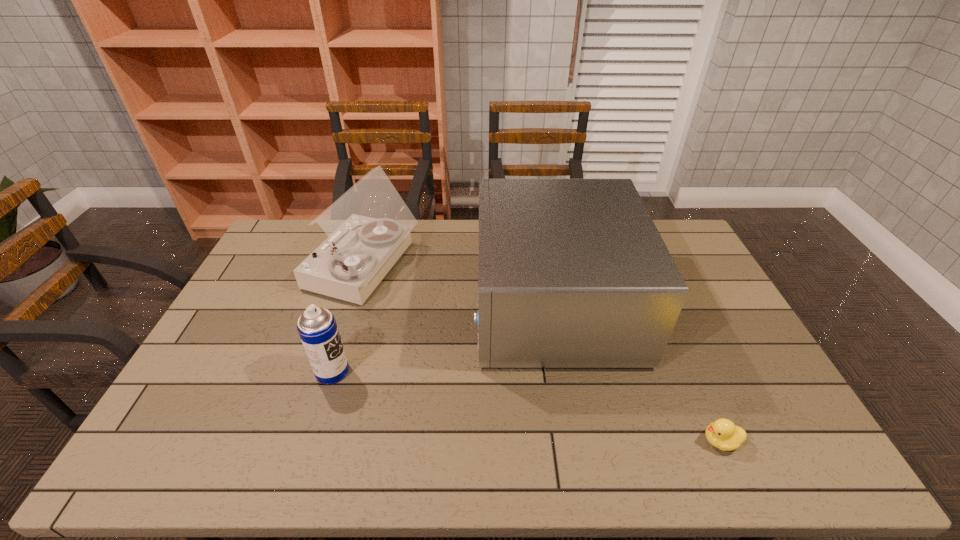
In the image, there is a desktop. At what (x,y) coordinates should I click in order to perform the action: click on free space at the left edge. Please return your answer as a coordinate pair (x, y). Image resolution: width=960 pixels, height=540 pixels. Looking at the image, I should click on (214, 380).

Locate an element on the screen. vacant space at the right edge of the desktop is located at coordinates (780, 421).

This screenshot has height=540, width=960. Identify the location of empty space that is in between the microwave oven and the aerosol can. (443, 338).

Find the location of `free space between the record player and the aerosol can`. free space between the record player and the aerosol can is located at coordinates (348, 319).

The image size is (960, 540). Find the location of `vacant region between the microwave oven and the record player`. vacant region between the microwave oven and the record player is located at coordinates coord(459,285).

This screenshot has height=540, width=960. I want to click on free space between the microwave oven and the record player, so click(x=459, y=285).

Where is `free space between the shortest object and the second object from right to left`? This screenshot has height=540, width=960. free space between the shortest object and the second object from right to left is located at coordinates (636, 373).

Locate an element on the screen. This screenshot has height=540, width=960. empty location between the record player and the third object from left to right is located at coordinates coord(459,285).

You are a GUI agent. You are given a task and a screenshot of the screen. Output one action in this format:
    pyautogui.click(x=<x>, y=<y>)
    Task: Click on the empty space that is in between the aerosol can and the record player
    The height and width of the screenshot is (540, 960).
    Given the screenshot: What is the action you would take?
    pyautogui.click(x=348, y=319)

Locate an element on the screen. The height and width of the screenshot is (540, 960). vacant space that is in between the third object from left to right and the shortest object is located at coordinates (x=636, y=373).